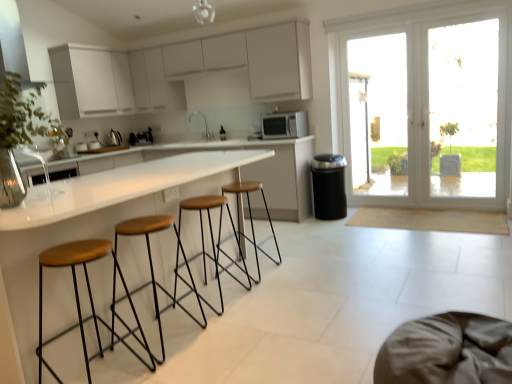
Identify the location of vacant space behind brown fabric swivel chair at lower right. The height and width of the screenshot is (384, 512). coord(364,314).